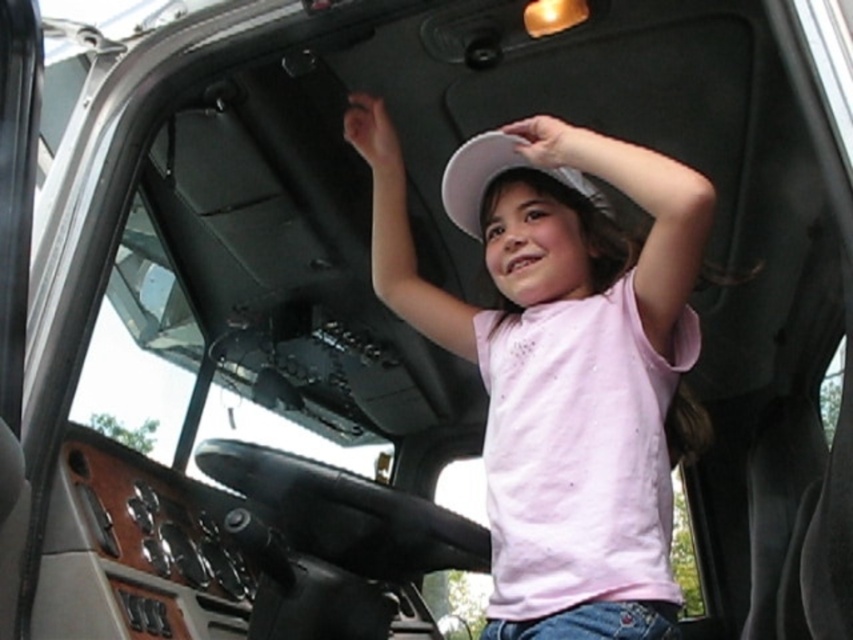
Question: Which object appears closest to the camera in this image?

Choices:
 (A) white matte hat at upper center
 (B) white matte hat at center

Answer: (A)

Question: Which of the following is the closest to the observer?

Choices:
 (A) (491, 179)
 (B) (451, 316)

Answer: (A)

Question: Does white matte hat at upper center appear on the left side of white matte hat at center?

Choices:
 (A) no
 (B) yes

Answer: (B)

Question: Which point appears farthest from the camera in this image?

Choices:
 (A) (577, 180)
 (B) (686, 237)

Answer: (A)

Question: Does white matte hat at upper center have a lesser width compared to white matte hat at center?

Choices:
 (A) no
 (B) yes

Answer: (A)

Question: Can you confirm if white matte hat at upper center is thinner than white matte hat at center?

Choices:
 (A) no
 (B) yes

Answer: (A)